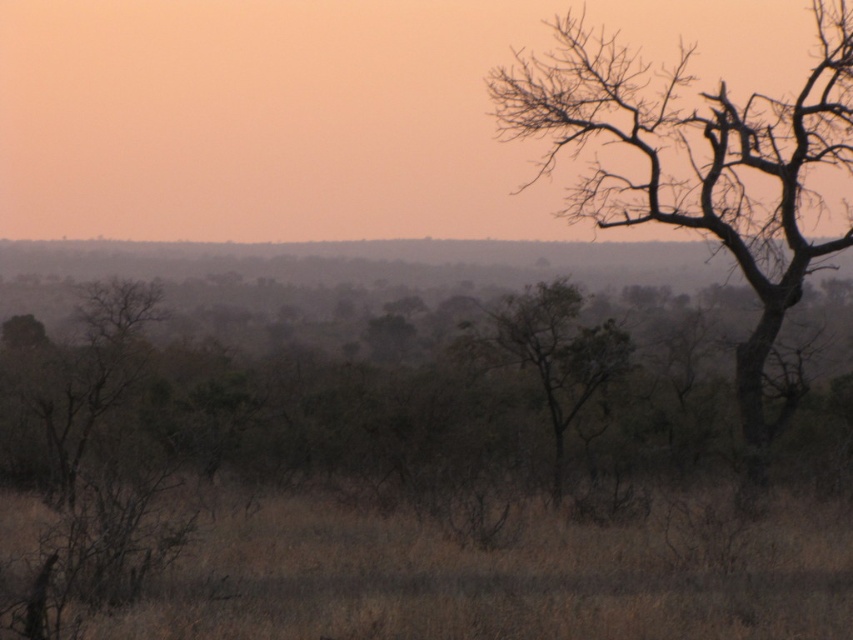
Question: Which of the following is the closest to the observer?

Choices:
 (A) (523, 81)
 (B) (534, 612)

Answer: (B)

Question: Is brown dry grass at lower center below brown/dry bark tree at upper right?

Choices:
 (A) no
 (B) yes

Answer: (B)

Question: Does brown dry grass at lower center have a smaller size compared to brown/dry bark tree at upper right?

Choices:
 (A) yes
 (B) no

Answer: (A)

Question: Which object is closer to the camera taking this photo?

Choices:
 (A) green leafy tree at center
 (B) brown dry grass at lower center
 (C) brown/dry bark tree at upper right

Answer: (B)

Question: Which point appears farthest from the camera in this image?

Choices:
 (A) (498, 83)
 (B) (286, 538)

Answer: (A)

Question: Can you confirm if brown dry grass at lower center is positioned above green leafy tree at center?

Choices:
 (A) no
 (B) yes

Answer: (A)